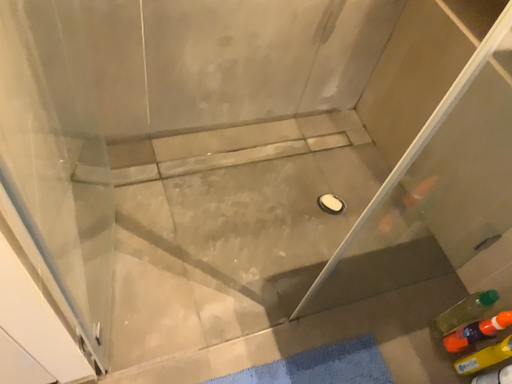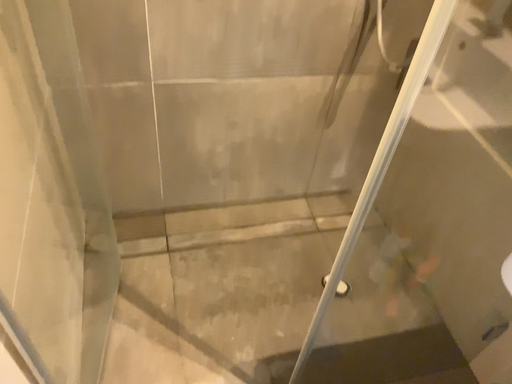
Question: Which way did the camera rotate in the video?

Choices:
 (A) rotated upward
 (B) rotated downward

Answer: (A)